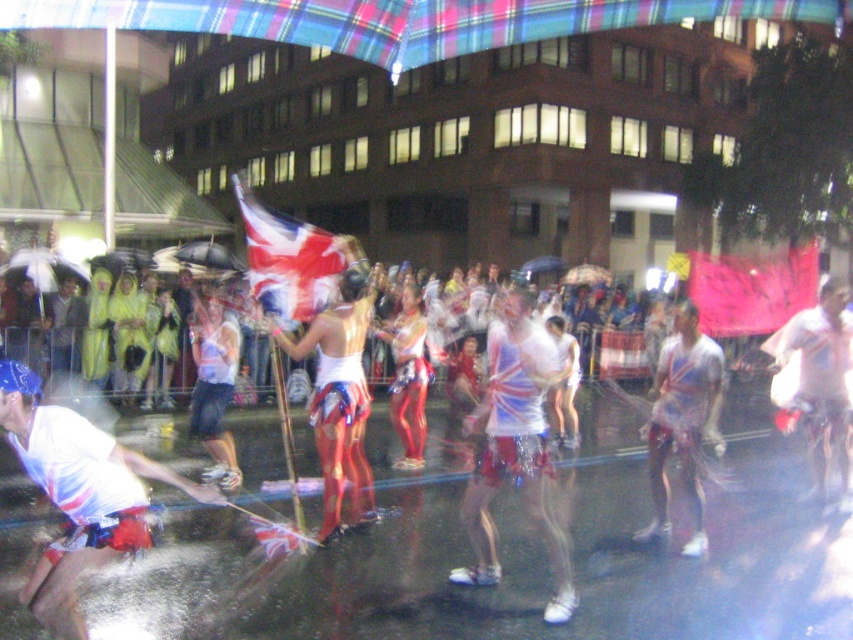
You are a photographer trying to capture the white glossy shirt at center and the union jack fabric flag at center in the same frame. Which object should you focus on first to ensure both are in focus?

The union jack fabric flag at center is behind the white glossy shirt at center, so you should focus on the union jack fabric flag at center first to ensure both are in focus.

You are a photographer positioned at the center of the scene. You want to capture a photo that includes the white glossy shirt at lower left. Which direction should you tilt your camera to ensure the shirt is in the frame?

Since the white glossy shirt at lower left is located at point 0.773 on the x axis and 0.094 on the y axis, you should tilt your camera to the lower left direction to include it in the frame.

You are a photographer at the festival scene. You want to capture a photo where both the white glossy shirt at center and the union jack fabric flag at center are visible. Which object should you zoom in on to ensure both are in frame?

Since the white glossy shirt at center has a lesser width compared to the union jack fabric flag at center, you should zoom in on the union jack fabric flag at center to ensure both objects are visible in the frame.